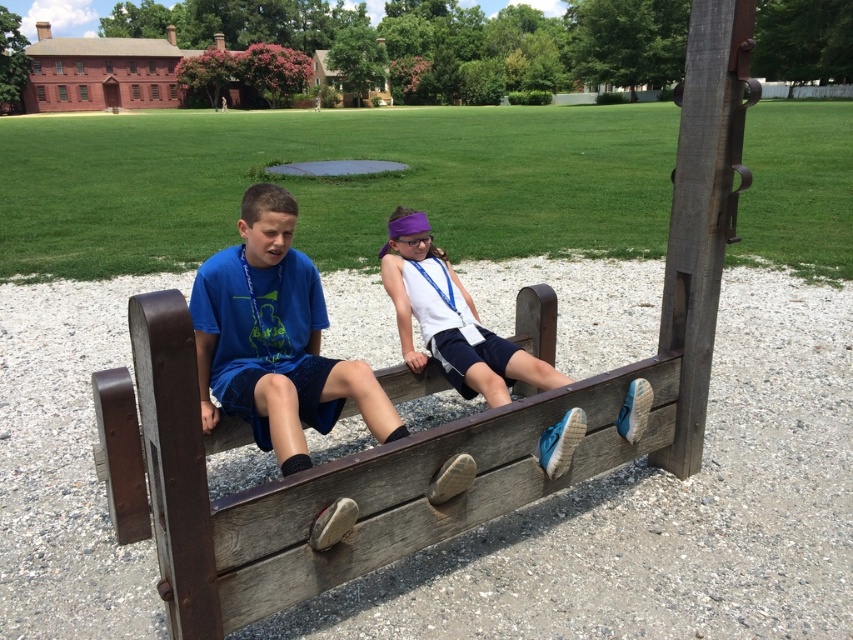
Question: Which object is farther from the camera taking this photo?

Choices:
 (A) blue fabric shirt at center
 (B) white matte tank top at center

Answer: (B)

Question: Is blue fabric shirt at center above white matte tank top at center?

Choices:
 (A) no
 (B) yes

Answer: (A)

Question: Which of the following is the farthest from the observer?

Choices:
 (A) blue fabric shirt at center
 (B) white matte tank top at center

Answer: (B)

Question: Does blue fabric shirt at center have a smaller size compared to white matte tank top at center?

Choices:
 (A) yes
 (B) no

Answer: (B)

Question: Does blue fabric shirt at center appear on the right side of white matte tank top at center?

Choices:
 (A) no
 (B) yes

Answer: (A)